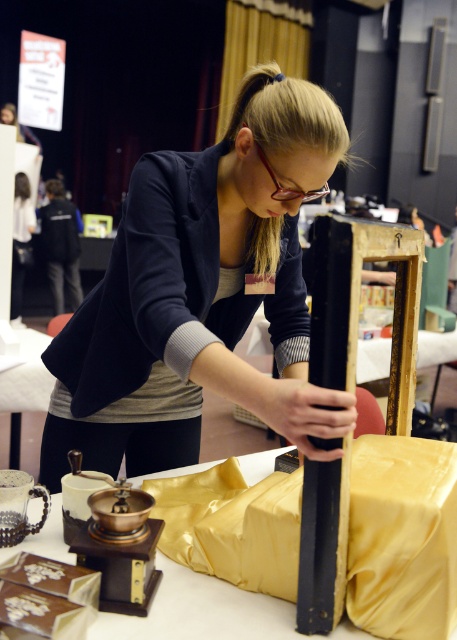
Consider the image. Does matte black pole at center have a greater width compared to gold satin table at lower center?

In fact, matte black pole at center might be narrower than gold satin table at lower center.

Is matte black pole at center closer to the viewer compared to gold satin table at lower center?

No, it is behind gold satin table at lower center.

Where is `matte black pole at center`? matte black pole at center is located at coordinates (201, 294).